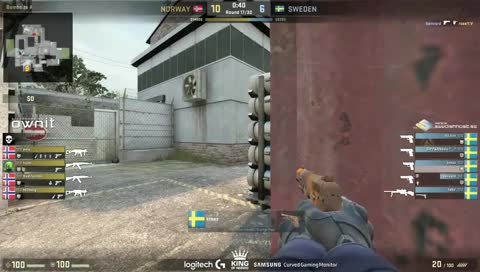
In order to click on wall in this screenshot , I will do `click(119, 133)`.